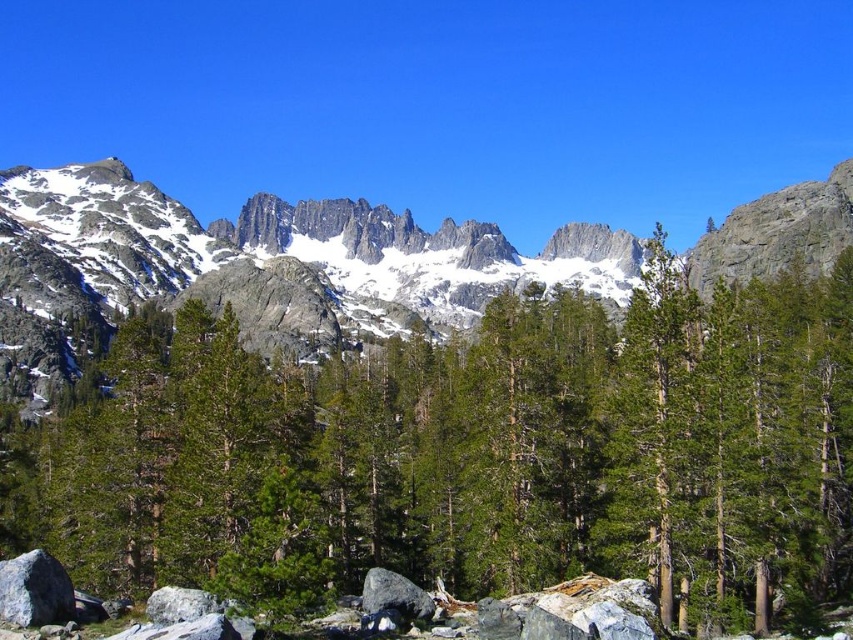
You are an explorer planning to cross from the gray rough boulder at lower left to the snowy granite mountain at center. Which path would require you to walk a greater distance horizontally? Please explain your reasoning based on the scene description.

The snowy granite mountain at center has a greater width than the gray rough boulder at lower left, so the path to the snowy granite mountain at center would require walking a greater horizontal distance because its width is larger than the gray rough boulder at lower left.

You are an environmental scientist assessing the ecological impact of a new hiking trail. You observe the green matte tree at center and the snowy granite mountain at center in the image. Which object would you prioritize for protection based on their visual prominence in the scene?

The snowy granite mountain at center occupies more space than the green matte tree at center, so it would be prioritized for protection due to its greater visual prominence in the scene.

You are standing in the mountain landscape and want to take a photo. You notice two points marked in the scene. Which point, point 1 at coordinates (416, 387) or point 2 at coordinates (392, 577), is closer to your camera lens?

Point 2 at coordinates (392, 577) is closer to the camera lens because it is less further to the camera than point 1 at coordinates (416, 387).